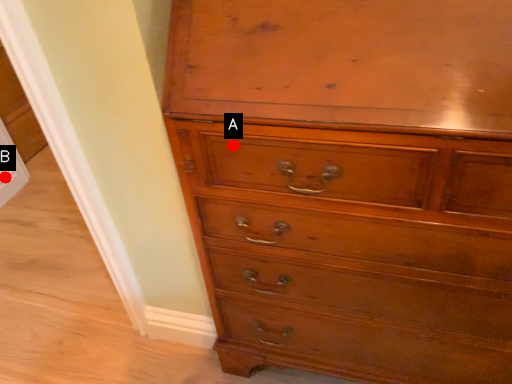
Question: Two points are circled on the image, labeled by A and B beside each circle. Among these points, which one is nearest to the camera?

Choices:
 (A) A is closer
 (B) B is closer

Answer: (A)